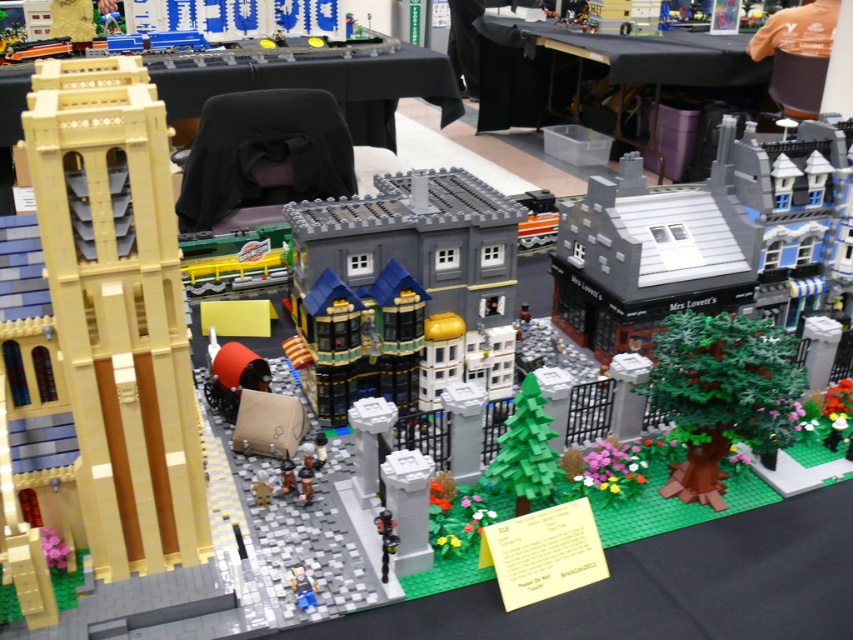
Consider the image. Which of these two, black plastic table at upper center or smooth plastic figure at center, stands shorter?

smooth plastic figure at center is shorter.

Measure the distance from black plastic table at upper center to smooth plastic figure at center.

They are 5.63 meters apart.

Where is `black plastic table at upper center`? This screenshot has height=640, width=853. black plastic table at upper center is located at coordinates (606, 77).

Locate an element on the screen. The height and width of the screenshot is (640, 853). black plastic table at upper center is located at coordinates (606, 77).

Is green matte tree at center behind smooth plastic figure at center?

Yes, green matte tree at center is behind smooth plastic figure at center.

Is green matte tree at center to the right of smooth plastic figure at center from the viewer's perspective?

Yes, green matte tree at center is to the right of smooth plastic figure at center.

Who is more forward, (498, 452) or (305, 593)?

Point (305, 593)

I want to click on green matte tree at center, so click(525, 451).

Is black plastic table at upper center to the left of shiny black figure at center from the viewer's perspective?

Incorrect, black plastic table at upper center is not on the left side of shiny black figure at center.

This screenshot has width=853, height=640. I want to click on black plastic table at upper center, so click(606, 77).